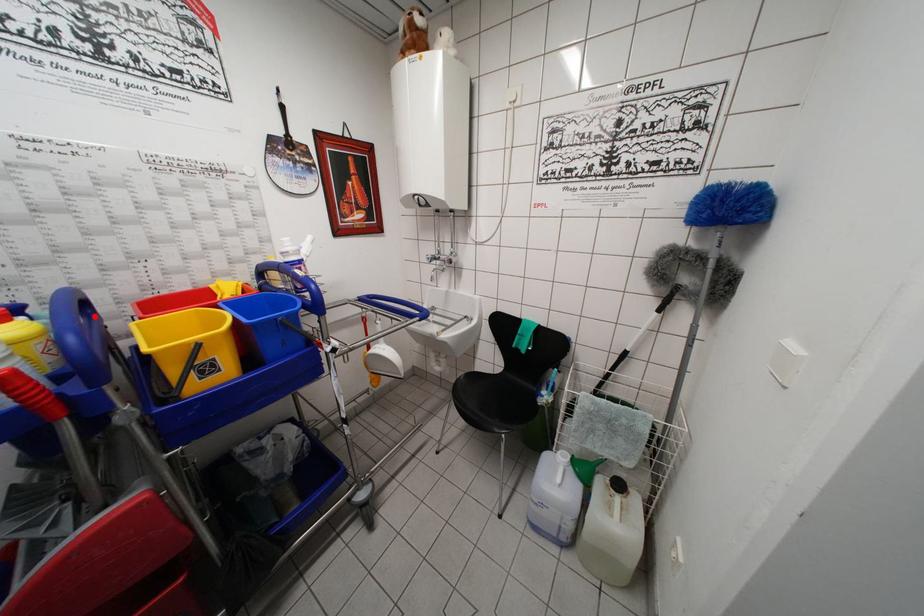
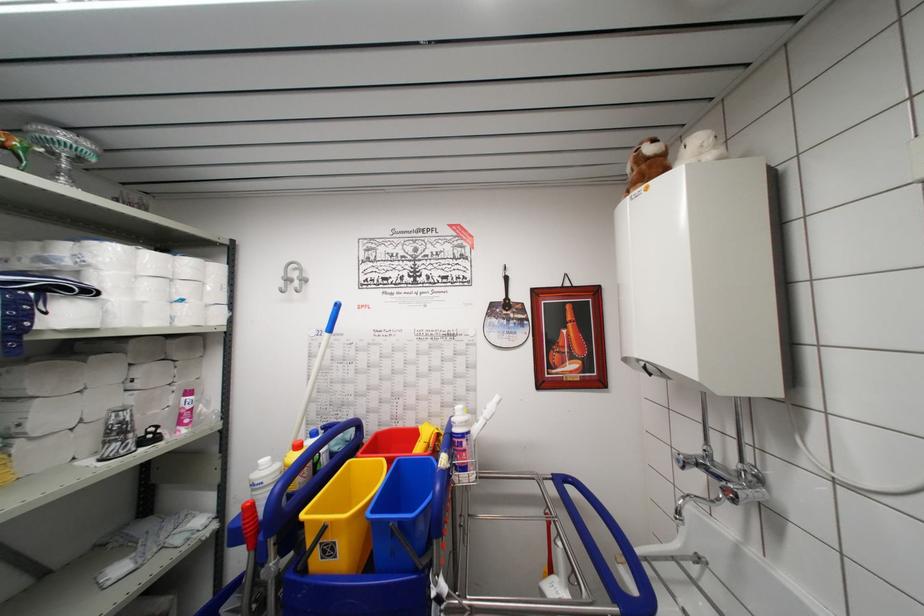
In the second image, find the point that corresponds to the highlighted location in the first image.

(361, 439)